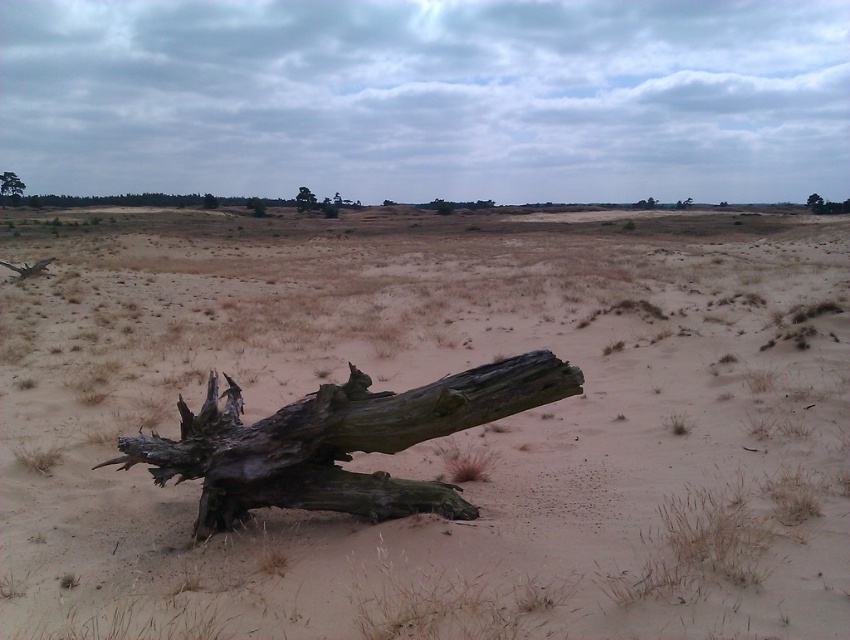
Question: Can you confirm if dark brown wood at center is smaller than dark brown wood at upper center?

Choices:
 (A) yes
 (B) no

Answer: (A)

Question: Does brown/dry sand at center have a larger size compared to dark brown wood at upper center?

Choices:
 (A) yes
 (B) no

Answer: (A)

Question: Can you confirm if dark brown wood at center is smaller than dark brown wood at upper center?

Choices:
 (A) yes
 (B) no

Answer: (A)

Question: Estimate the real-world distances between objects in this image. Which object is farther from the brown/dry sand at center?

Choices:
 (A) dark brown wood at center
 (B) dark brown wood at upper center
 (C) green rough bark tree at upper left

Answer: (C)

Question: Which object is farther from the camera taking this photo?

Choices:
 (A) dark brown wood at upper center
 (B) dark brown wood at center
 (C) brown/dry sand at center
 (D) green rough bark tree at upper left

Answer: (D)

Question: Which of the following is the farthest from the observer?

Choices:
 (A) (9, 179)
 (B) (222, 435)

Answer: (A)